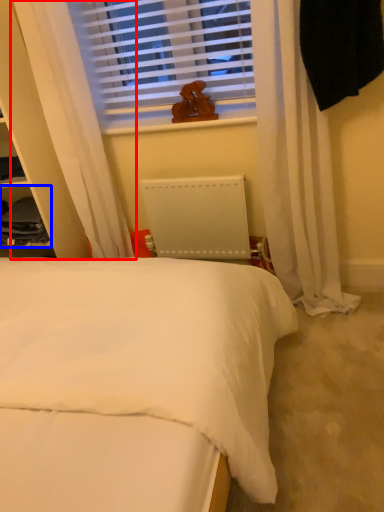
Question: Which point is further to the camera, curtain (highlighted by a red box) or cabinet (highlighted by a blue box)?

Choices:
 (A) curtain
 (B) cabinet

Answer: (B)